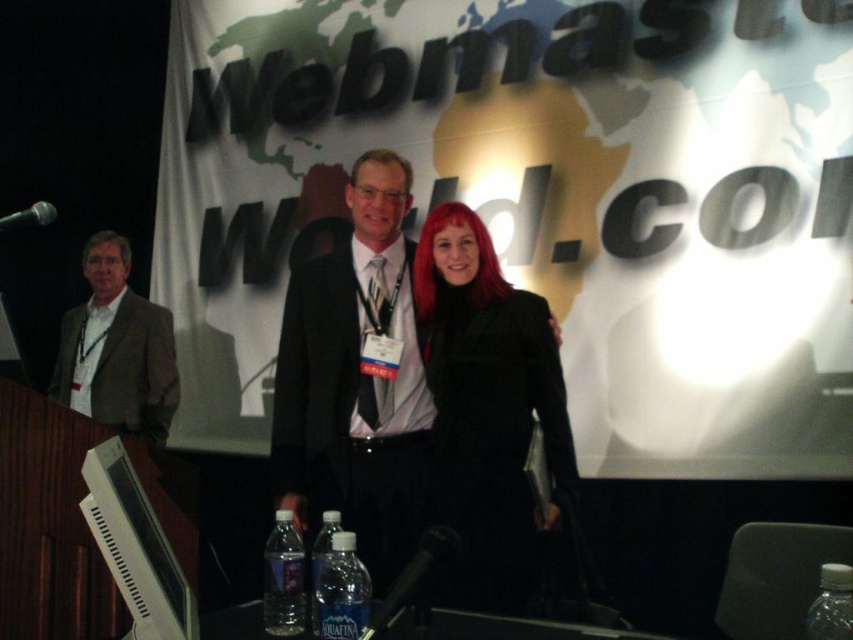
You are attending the WebmasterWorld.com conference and notice two individuals in suits. The first person is wearing a brown fabric suit at left, and the second is wearing a black satin suit at center. From your vantage point, which suit is positioned lower in the image?

The black satin suit at center is positioned lower than the brown fabric suit at left in the image.

Based on the scene description, where is the black satin suit at center located in terms of its 2D coordinates?

The black satin suit at center is located at the 2D coordinates point [352,404].